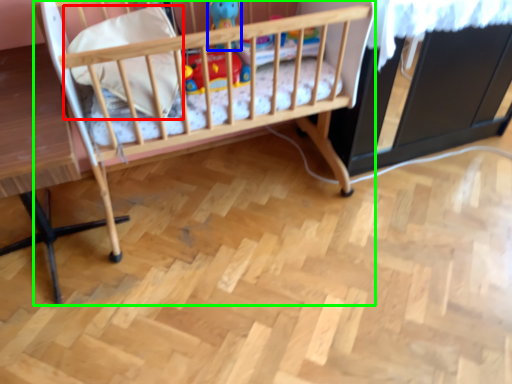
Question: Considering the real-world distances, which object is farthest from pillow (highlighted by a red box)? toy (highlighted by a blue box) or infant bed (highlighted by a green box)?

Choices:
 (A) toy
 (B) infant bed

Answer: (A)